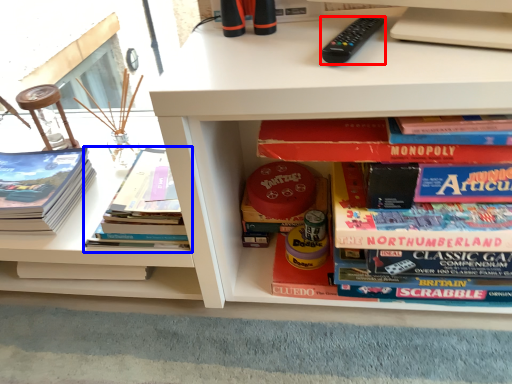
Question: Which object appears farthest to the camera in this image, remote control (highlighted by a red box) or book (highlighted by a blue box)?

Choices:
 (A) remote control
 (B) book

Answer: (B)